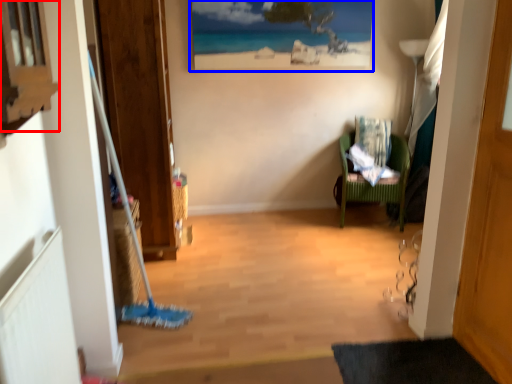
Question: Which object appears closest to the camera in this image, window (highlighted by a red box) or picture frame (highlighted by a blue box)?

Choices:
 (A) window
 (B) picture frame

Answer: (A)